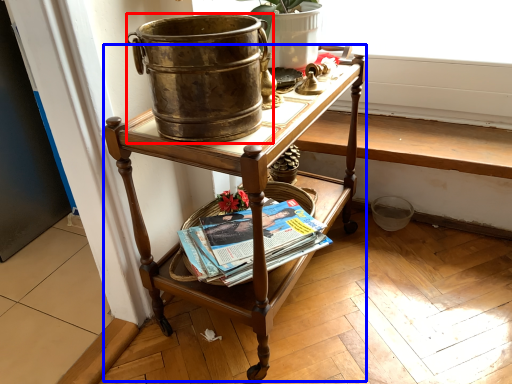
Question: Which object is closer to the camera taking this photo, flowerpot (highlighted by a red box) or desk (highlighted by a blue box)?

Choices:
 (A) flowerpot
 (B) desk

Answer: (A)